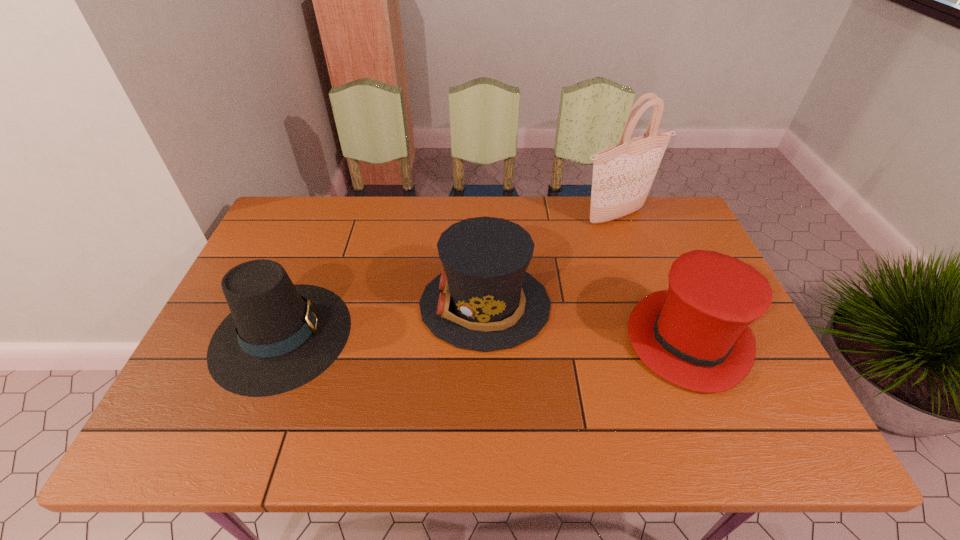
This screenshot has height=540, width=960. What are the coordinates of `the tallest object` in the screenshot? It's located at (623, 174).

Identify the location of shopping bag. (623, 174).

Identify the location of the second object from left to right. The width and height of the screenshot is (960, 540). (484, 300).

Identify the location of the rightmost hat. The height and width of the screenshot is (540, 960). (695, 335).

Find the location of a particular element. the leftmost object is located at coordinates (279, 336).

This screenshot has height=540, width=960. I want to click on free region located 0.320m on the front of the farthest object, so click(647, 307).

Identify the location of vacant space located with goggles on the front of the second hat from left to right. This screenshot has height=540, width=960. (360, 305).

The height and width of the screenshot is (540, 960). In order to click on vacant space located 0.250m with goggles on the front of the second hat from left to right in this screenshot , I will do `click(327, 305)`.

You are a GUI agent. You are given a task and a screenshot of the screen. Output one action in this format:
    pyautogui.click(x=<x>, y=<y>)
    Task: Click on the vacant space located with goggles on the front of the second hat from left to right
    Image resolution: width=960 pixels, height=540 pixels.
    Given the screenshot: What is the action you would take?
    pyautogui.click(x=349, y=305)

What are the coordinates of `free space located on the back of the rightmost hat` in the screenshot? It's located at click(x=646, y=237).